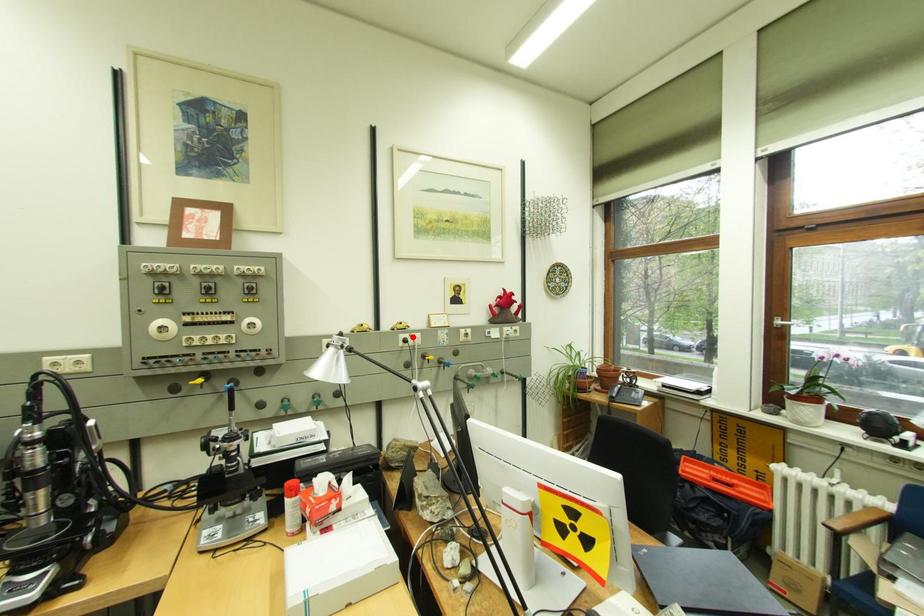
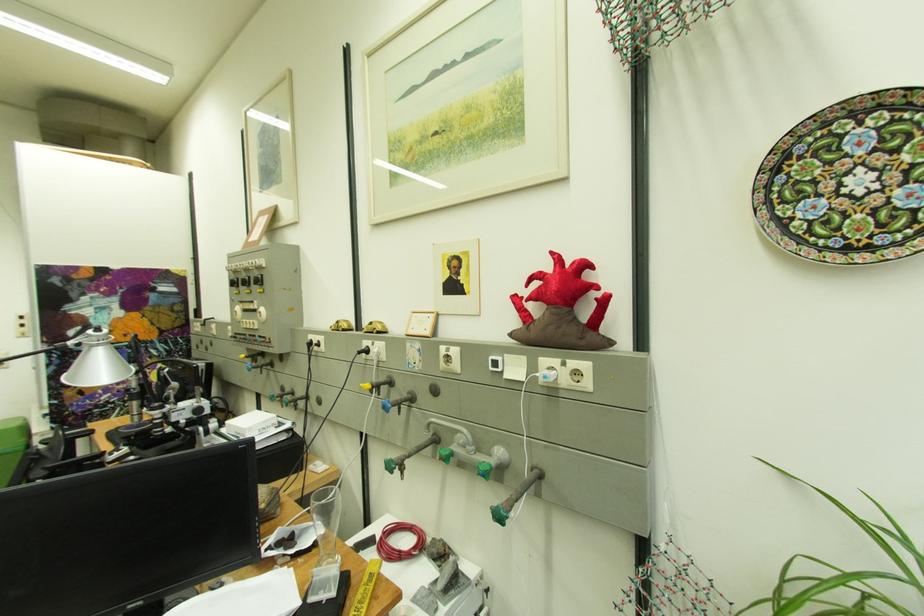
Locate, in the second image, the point that corresponds to the highlighted location in the first image.

(375, 344)